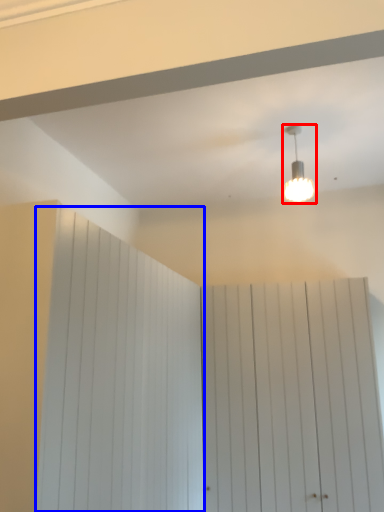
Question: Which of the following is the farthest to the observer, lamp (highlighted by a red box) or barn door (highlighted by a blue box)?

Choices:
 (A) lamp
 (B) barn door

Answer: (A)